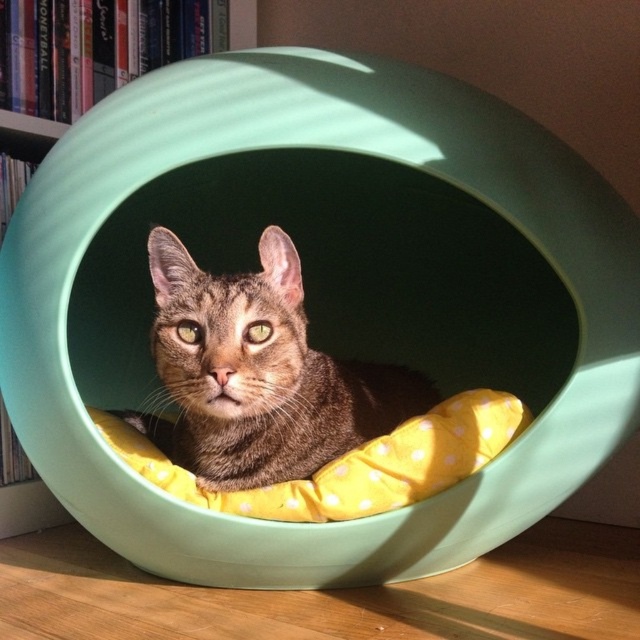
You are a delivery robot that needs to place a package on the matte plastic bookshelf at upper left. The robot is 24 inches wide. Can you move from your current position to the bookshelf without hitting the brown fur cat at center?

The brown fur cat at center is 26.35 inches from the matte plastic bookshelf at upper left. Since the robot is 24 inches wide, there is enough space between them to navigate safely. The robot can move to the bookshelf without hitting the cat.

What is located at the coordinates point (259, 372) in the image?

The point (259, 372) corresponds to the brown fur cat at center.

You are a photographer trying to capture a clear shot of the brown fur cat at center without any obstructions. Since the matte plastic bookshelf at upper left is in the background, will the cat be visible clearly in your photo?

The brown fur cat at center is in front of the matte plastic bookshelf at upper left, so the cat will be visible clearly in the photo as it is positioned in front of the bookshelf.